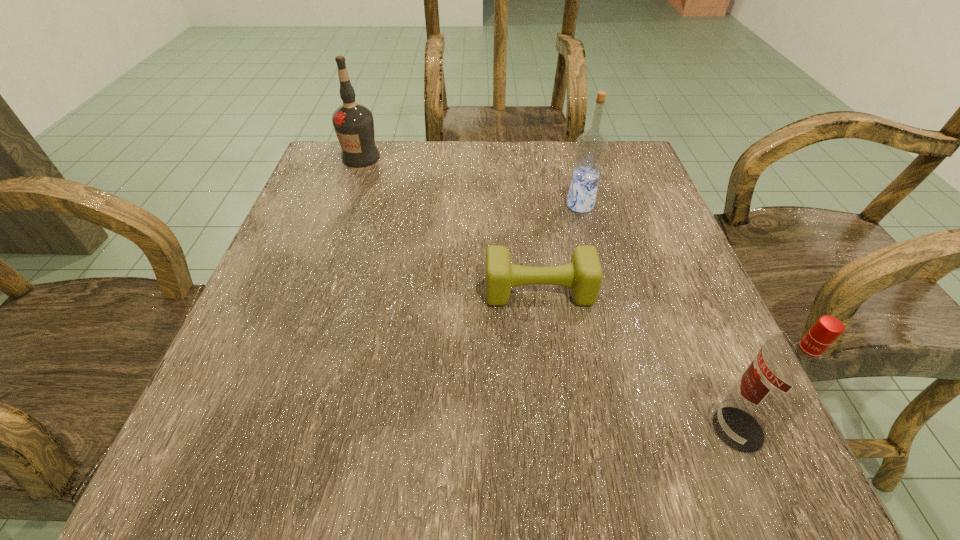
Find the location of a particular element. vacant region located 0.260m on the front label of the nearest object is located at coordinates (515, 429).

Identify the location of vacant area located 0.050m on the front label of the nearest object. This screenshot has height=540, width=960. (674, 429).

Image resolution: width=960 pixels, height=540 pixels. Identify the location of free spot located 0.400m on the front label of the nearest object. (409, 429).

Identify the location of free space located 0.300m on the left of the third farthest object. This screenshot has width=960, height=540. click(x=310, y=292).

At what (x,y) coordinates should I click in order to perform the action: click on object that is at the near edge. Please return your answer as a coordinate pair (x, y). Looking at the image, I should click on (789, 373).

Where is `object positioned at the left edge`? object positioned at the left edge is located at coordinates (353, 123).

I want to click on object that is at the far left corner, so click(353, 123).

The image size is (960, 540). I want to click on object located in the far right corner section of the desktop, so click(x=591, y=147).

Where is `object that is at the near right corner`? Image resolution: width=960 pixels, height=540 pixels. object that is at the near right corner is located at coordinates click(789, 373).

Where is `vacant area at the far edge`? The width and height of the screenshot is (960, 540). vacant area at the far edge is located at coordinates (565, 168).